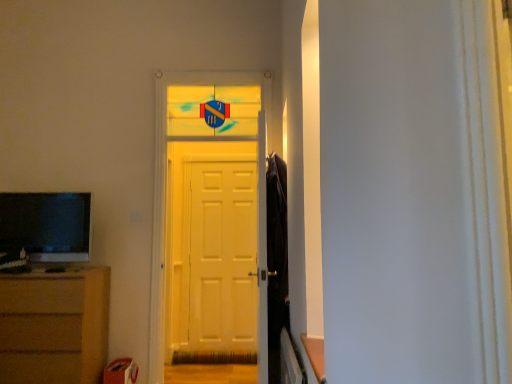
Find the location of a particular element. free space above white matte door at center (from a real-world perspective) is located at coordinates 220,162.